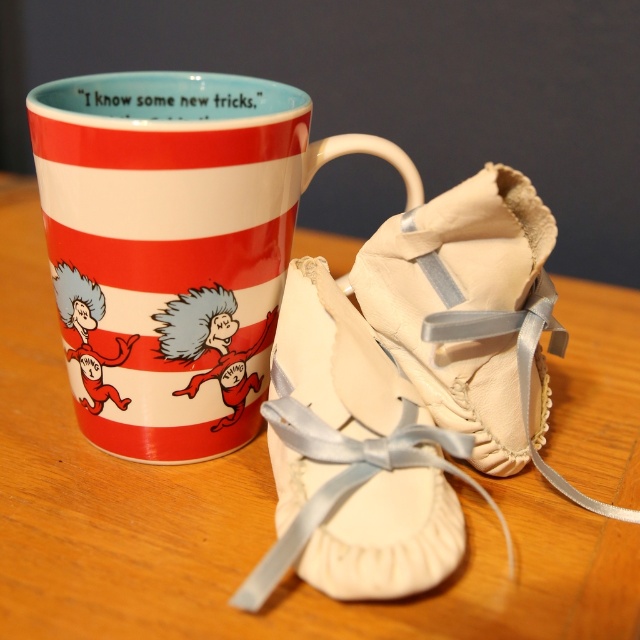
You are a delivery person placing a package on the wooden table at center. The package is 10 cm tall. The white satin ballet shoes at center are currently on the table. Can the package be placed on the table without moving the ballet shoes?

The wooden table at center is in front of the white satin ballet shoes at center, which means the ballet shoes are not on the table. Therefore, the package can be placed on the table without moving anything.

Looking at this image, you are standing in front of a table with a ceramic mug and ballet slippers. The mug has a red and white striped pattern with characters labeled THING 1 and THING 2. The ballet slippers are cream colored and tied with ribbons. There is a specific point on the table marked at coordinates point (67, 563). If you want to place a small ornament exactly 40 inches away from that point, will it be within your reach if you are 5 feet tall?

The distance from the point (67, 563) to the viewer is 37.49 inches. Since you are 5 feet tall, which is 60 inches, the ornament placed 40 inches away from the point would be 37.49 plus 40 equals 77.49 inches away from you. This is beyond your reach as you can only comfortably reach up to about 60 inches.

You are trying to place the white satin ballet shoes at center on the wooden table at center. Based on the scene description, can the ballet shoes fit on the table?

The wooden table at center might be wider than white satin ballet shoes at center, so there is a possibility that the ballet shoes can fit on the table.